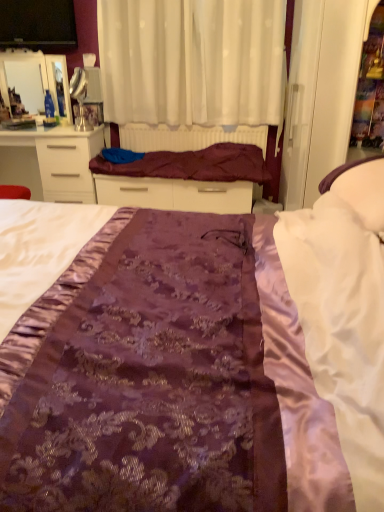
Question: In terms of width, does purple satin bed at center look wider or thinner when compared to matte black tv at upper left?

Choices:
 (A) wide
 (B) thin

Answer: (A)

Question: From the image's perspective, is purple satin bed at center positioned above or below matte black tv at upper left?

Choices:
 (A) above
 (B) below

Answer: (B)

Question: Estimate the real-world distances between objects in this image. Which object is closer to the matte black tv at upper left?

Choices:
 (A) white satin pillow at right
 (B) purple satin bed at center
 (C) maroon satin blanket at center
 (D) white glossy drawer at upper left
 (E) purple satin bed frame at center

Answer: (D)

Question: Which object is positioned closest to the purple satin bed frame at center?

Choices:
 (A) white satin pillow at right
 (B) white sheer curtain at upper center
 (C) white glossy drawer at upper left
 (D) matte black tv at upper left
 (E) purple satin bed at center

Answer: (B)